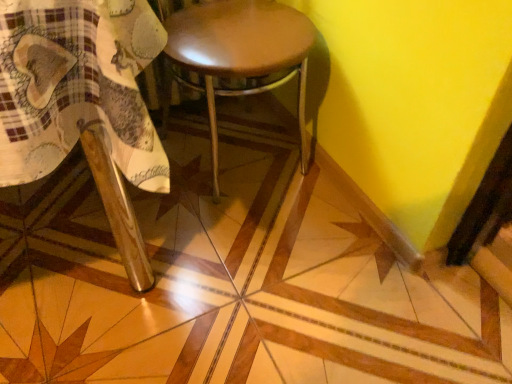
The image size is (512, 384). I want to click on wooden chair at lower left, so click(83, 103).

The height and width of the screenshot is (384, 512). What do you see at coordinates (83, 103) in the screenshot?
I see `wooden chair at lower left` at bounding box center [83, 103].

Measure the distance between point (x=123, y=94) and camera.

Point (x=123, y=94) is 23.19 inches from camera.

Locate an element on the screen. This screenshot has width=512, height=384. shiny brown stool at center is located at coordinates (240, 55).

What is the approximate height of shiny brown stool at center?

It is 24.57 inches.

What do you see at coordinates (240, 55) in the screenshot? The image size is (512, 384). I see `shiny brown stool at center` at bounding box center [240, 55].

The image size is (512, 384). What are the coordinates of `wooden chair at lower left` in the screenshot? It's located at (83, 103).

Considering the relative positions of shiny brown stool at center and wooden chair at lower left in the image provided, is shiny brown stool at center to the left of wooden chair at lower left from the viewer's perspective?

In fact, shiny brown stool at center is to the right of wooden chair at lower left.

In the image, is shiny brown stool at center positioned in front of or behind wooden chair at lower left?

shiny brown stool at center is behind wooden chair at lower left.

Does point (196, 22) lie behind point (42, 83)?

Yes.

From the image's perspective, which one is positioned lower, shiny brown stool at center or wooden chair at lower left?

wooden chair at lower left, from the image's perspective.

From a real-world perspective, does shiny brown stool at center sit lower than wooden chair at lower left?

Yes, from a real-world perspective, shiny brown stool at center is under wooden chair at lower left.

Looking at their sizes, would you say shiny brown stool at center is wider or thinner than wooden chair at lower left?

In the image, shiny brown stool at center appears to be more narrow than wooden chair at lower left.

Considering the relative sizes of shiny brown stool at center and wooden chair at lower left in the image provided, is shiny brown stool at center shorter than wooden chair at lower left?

Yes.

Based on the photo, is shiny brown stool at center bigger or smaller than wooden chair at lower left?

shiny brown stool at center is smaller than wooden chair at lower left.

Is shiny brown stool at center inside or outside of wooden chair at lower left?

The correct answer is: outside.

Does shiny brown stool at center touch wooden chair at lower left?

No, shiny brown stool at center is not beside wooden chair at lower left.

Could you tell me if shiny brown stool at center is facing wooden chair at lower left?

No, shiny brown stool at center is not oriented towards wooden chair at lower left.

How different are the orientations of shiny brown stool at center and wooden chair at lower left in degrees?

shiny brown stool at center and wooden chair at lower left are facing 0.000404 degrees away from each other.

Locate an element on the screen. stool above the wooden chair at lower left (from the image's perspective) is located at coordinates pyautogui.click(x=240, y=55).

Considering the relative positions of wooden chair at lower left and shiny brown stool at center in the image provided, is wooden chair at lower left to the left or to the right of shiny brown stool at center?

wooden chair at lower left is to the left of shiny brown stool at center.

Considering their positions, is wooden chair at lower left located in front of or behind shiny brown stool at center?

wooden chair at lower left is in front of shiny brown stool at center.

Does point (146, 179) appear closer or farther from the camera than point (198, 69)?

Point (146, 179).

Based on the photo, from the image's perspective, is wooden chair at lower left positioned above or below shiny brown stool at center?

Clearly, from the image's perspective, wooden chair at lower left is below shiny brown stool at center.

From a real-world perspective, is wooden chair at lower left under shiny brown stool at center?

No, from a real-world perspective, wooden chair at lower left is not below shiny brown stool at center.

Is wooden chair at lower left wider than shiny brown stool at center?

Yes.

Is wooden chair at lower left taller or shorter than shiny brown stool at center?

Considering their sizes, wooden chair at lower left has more height than shiny brown stool at center.

Between wooden chair at lower left and shiny brown stool at center, which one has smaller size?

shiny brown stool at center is smaller.

Is wooden chair at lower left inside the boundaries of shiny brown stool at center, or outside?

wooden chair at lower left is not inside shiny brown stool at center, it's outside.

Are wooden chair at lower left and shiny brown stool at center making contact?

They are not placed beside each other.

Could you tell me if wooden chair at lower left is turned towards shiny brown stool at center?

No, wooden chair at lower left is not aimed at shiny brown stool at center.

Can you tell me how much wooden chair at lower left and shiny brown stool at center differ in facing direction?

The angle between the facing direction of wooden chair at lower left and the facing direction of shiny brown stool at center is 0.000404 degrees.

Measure the distance from wooden chair at lower left to shiny brown stool at center.

A distance of 17.52 inches exists between wooden chair at lower left and shiny brown stool at center.

Find the location of a particular element. The image size is (512, 384). chair above the shiny brown stool at center (from a real-world perspective) is located at coordinates (83, 103).

The image size is (512, 384). In order to click on stool on the right of wooden chair at lower left in this screenshot , I will do `click(240, 55)`.

Image resolution: width=512 pixels, height=384 pixels. Identify the location of stool above the wooden chair at lower left (from the image's perspective). (240, 55).